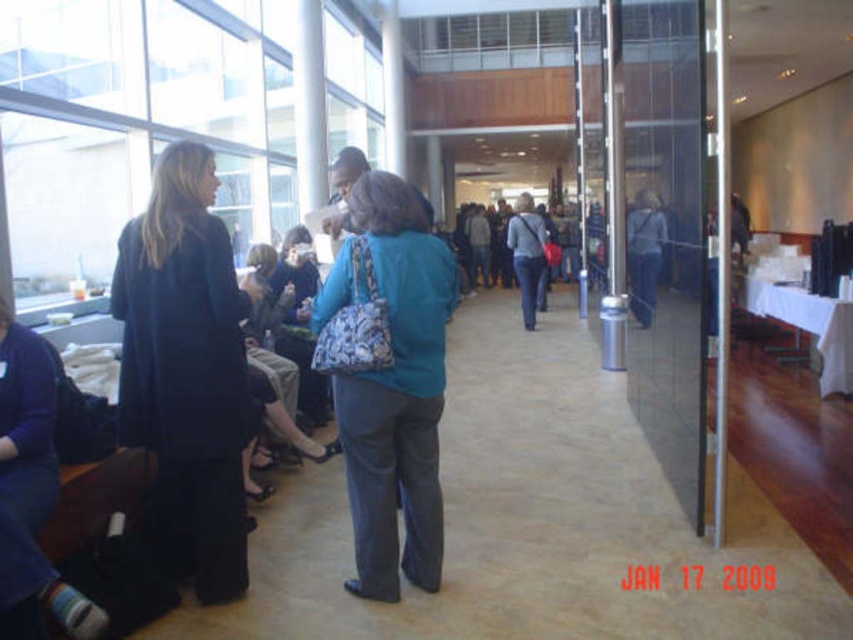
Question: Which of the following is the farthest from the observer?

Choices:
 (A) (532, 237)
 (B) (189, 164)

Answer: (A)

Question: Which point is closer to the camera?

Choices:
 (A) blue denim jeans at center
 (B) teal fabric purse at center

Answer: (B)

Question: Does teal fabric purse at center appear under blue fabric jacket at center?

Choices:
 (A) yes
 (B) no

Answer: (A)

Question: Is teal fabric purse at center wider than blue fabric jacket at center?

Choices:
 (A) yes
 (B) no

Answer: (A)

Question: Which point is farther to the camera?

Choices:
 (A) (634, 298)
 (B) (512, 240)
 (C) (131, 317)
 (D) (369, 541)

Answer: (B)

Question: Can you confirm if dark blue fabric coat at left is positioned above teal fabric purse at center?

Choices:
 (A) yes
 (B) no

Answer: (A)